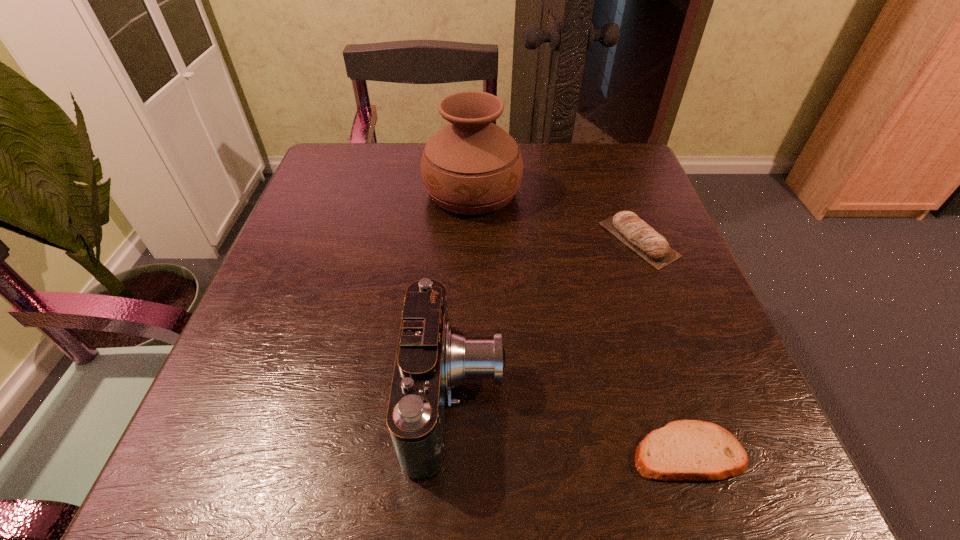
Where is `vacant region at the far right corner of the desktop`? The height and width of the screenshot is (540, 960). vacant region at the far right corner of the desktop is located at coordinates (656, 197).

Locate an element on the screen. The width and height of the screenshot is (960, 540). free space between the taller pita bread and the shortest object is located at coordinates (663, 346).

The width and height of the screenshot is (960, 540). In order to click on vacant area between the camcorder and the tallest object in this screenshot , I will do `click(465, 294)`.

You are a GUI agent. You are given a task and a screenshot of the screen. Output one action in this format:
    pyautogui.click(x=<x>, y=<y>)
    Task: Click on the blank region between the taller pita bread and the shorter pita bread
    This screenshot has width=960, height=540.
    Given the screenshot: What is the action you would take?
    pyautogui.click(x=663, y=346)

Locate an element on the screen. empty location between the nearer pita bread and the tallest object is located at coordinates (580, 322).

Locate an element on the screen. The image size is (960, 540). free space between the farther pita bread and the urn is located at coordinates (556, 216).

The width and height of the screenshot is (960, 540). Identify the location of unoccupied area between the shortest object and the third shortest object. (572, 424).

This screenshot has height=540, width=960. I want to click on free space between the camcorder and the nearer pita bread, so click(x=572, y=424).

You are a GUI agent. You are given a task and a screenshot of the screen. Output one action in this format:
    pyautogui.click(x=<x>, y=<y>)
    Task: Click on the unoccupied area between the farther pita bread and the second tallest object
    Image resolution: width=960 pixels, height=540 pixels.
    Given the screenshot: What is the action you would take?
    pyautogui.click(x=547, y=318)

You are a GUI agent. You are given a task and a screenshot of the screen. Output one action in this format:
    pyautogui.click(x=<x>, y=<y>)
    Task: Click on the free space between the second tallest object and the farther pita bread
    The image size is (960, 540).
    Given the screenshot: What is the action you would take?
    pyautogui.click(x=547, y=318)